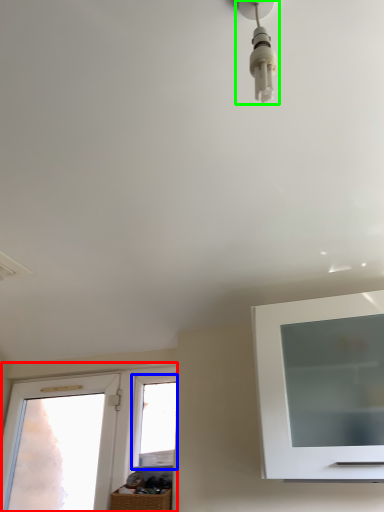
Question: Which object is the closest to the window (highlighted by a red box)? Choose among these: window (highlighted by a blue box) or light fixture (highlighted by a green box).

Choices:
 (A) window
 (B) light fixture

Answer: (A)